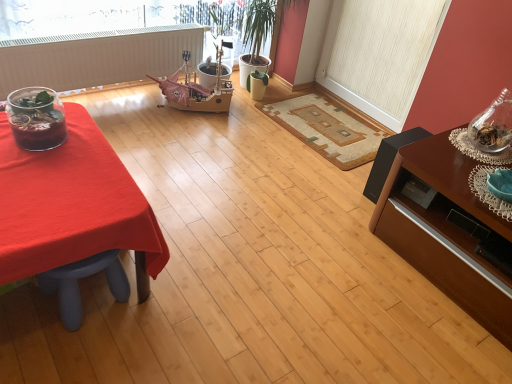
Question: In the image, is clear glass jar at right positioned in front of or behind translucent glass terrarium at left?

Choices:
 (A) behind
 (B) front

Answer: (A)

Question: Looking at their shapes, would you say clear glass jar at right is wider or thinner than translucent glass terrarium at left?

Choices:
 (A) wide
 (B) thin

Answer: (B)

Question: Which object is positioned farthest from the white matte radiator at upper left?

Choices:
 (A) beige woven mat at center
 (B) translucent glass terrarium at left
 (C) clear glass jar at right
 (D) smooth red tablecloth at left
 (E) white textured screen door at upper right

Answer: (C)

Question: Which of these objects is positioned closest to the brown wood table at right?

Choices:
 (A) white textured screen door at upper right
 (B) translucent glass terrarium at left
 (C) beige woven mat at center
 (D) smooth red tablecloth at left
 (E) white matte radiator at upper left

Answer: (C)